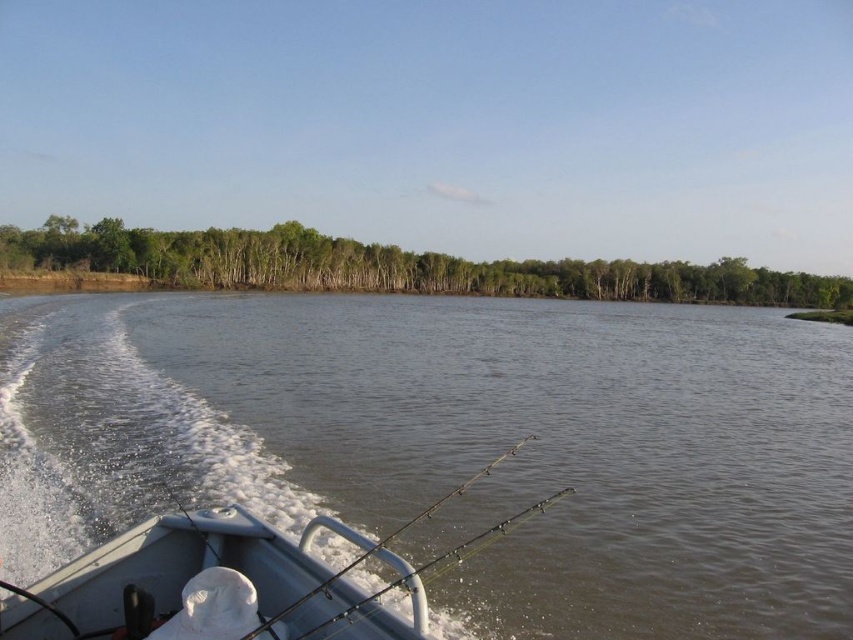
You are a GUI agent. You are given a task and a screenshot of the screen. Output one action in this format:
    pyautogui.click(x=<x>, y=<y>)
    Task: Click on the green leafy trees at upper center
    The image size is (853, 640).
    Given the screenshot: What is the action you would take?
    pyautogui.click(x=392, y=266)

Is green leafy trees at upper center below green metallic fishing pole at center?

Incorrect, green leafy trees at upper center is not positioned below green metallic fishing pole at center.

Is point (480, 289) closer to viewer compared to point (460, 486)?

No.

Image resolution: width=853 pixels, height=640 pixels. Find the location of `green leafy trees at upper center`. green leafy trees at upper center is located at coordinates (392, 266).

Does brown water at center appear on the left side of green leafy trees at upper center?

Yes, brown water at center is to the left of green leafy trees at upper center.

Can you confirm if brown water at center is shorter than green leafy trees at upper center?

Indeed, brown water at center has a lesser height compared to green leafy trees at upper center.

Who is more forward, (398, 360) or (361, 244)?

Positioned in front is point (398, 360).

Find the location of `brown water at center`. brown water at center is located at coordinates (456, 445).

Is brown water at center taller than green metallic fishing pole at center?

Indeed, brown water at center has a greater height compared to green metallic fishing pole at center.

Who is more forward, [438,632] or [294,604]?

Point [294,604]

Who is more distant from viewer, [370,340] or [389,540]?

Positioned behind is point [370,340].

You are a GUI agent. You are given a task and a screenshot of the screen. Output one action in this format:
    pyautogui.click(x=<x>, y=<y>)
    Task: Click on the brown water at center
    
    Given the screenshot: What is the action you would take?
    pyautogui.click(x=456, y=445)